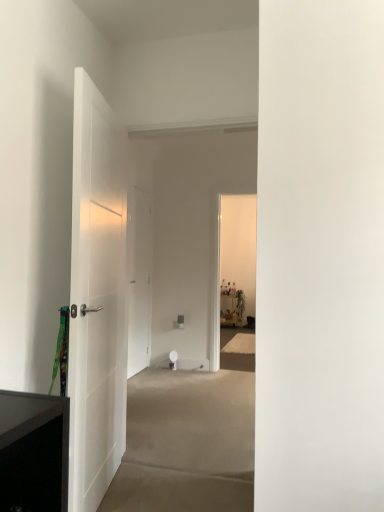
Question: Based on their positions, is white matte door at left, arranged as the first door when viewed from the front, located to the left or right of white matte door at center, acting as the second door starting from the front?

Choices:
 (A) left
 (B) right

Answer: (B)

Question: Choose the correct answer: Is white matte door at left, arranged as the first door when viewed from the front, inside white matte door at center, acting as the second door starting from the front, or outside it?

Choices:
 (A) inside
 (B) outside

Answer: (B)

Question: From a real-world perspective, relative to white matte door at center, acting as the second door starting from the front, is white matte door at left, the second door viewed from the back, vertically above or below?

Choices:
 (A) above
 (B) below

Answer: (B)

Question: Is white matte door at center, acting as the second door starting from the front, wider or thinner than white matte door at left, the second door viewed from the back?

Choices:
 (A) wide
 (B) thin

Answer: (B)

Question: From a real-world perspective, is white matte door at center, acting as the second door starting from the front, positioned above or below white matte door at left, the second door viewed from the back?

Choices:
 (A) above
 (B) below

Answer: (A)

Question: From the image's perspective, is white matte door at center, acting as the second door starting from the front, above or below white matte door at left, the second door viewed from the back?

Choices:
 (A) above
 (B) below

Answer: (B)

Question: Considering their positions, is white matte door at center, which ranks as the first door in back-to-front order, located in front of or behind white matte door at left, the second door viewed from the back?

Choices:
 (A) front
 (B) behind

Answer: (B)